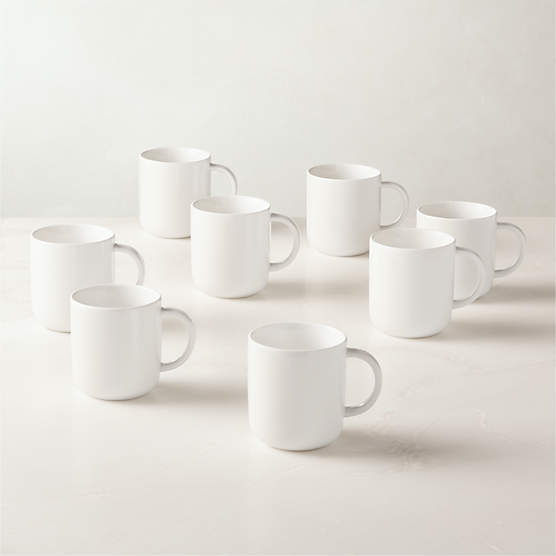
The height and width of the screenshot is (556, 556). I want to click on handles of the teacups, so point(188,329), point(143,269), point(364,358), point(297,242), point(404,197), point(476,261), point(520,246), point(231,177).